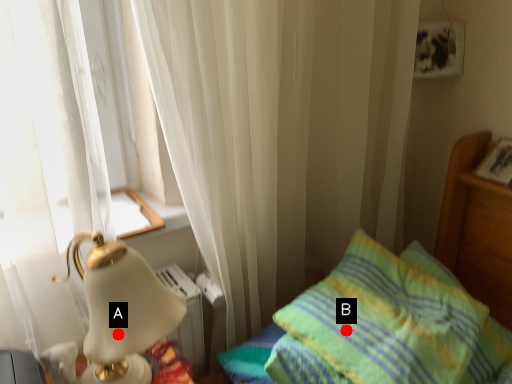
Question: Two points are circled on the image, labeled by A and B beside each circle. Which of the following is the closest to the observer?

Choices:
 (A) A is closer
 (B) B is closer

Answer: (A)